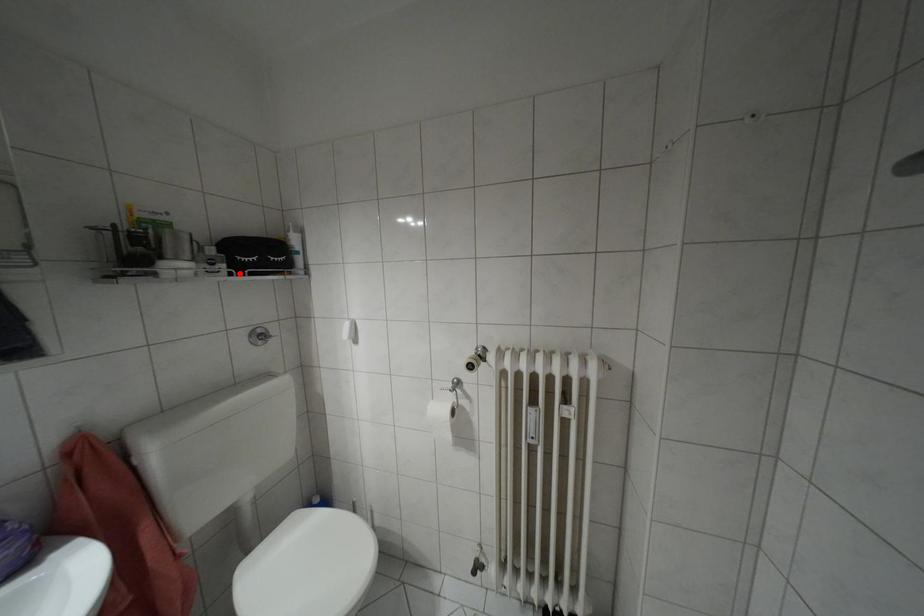
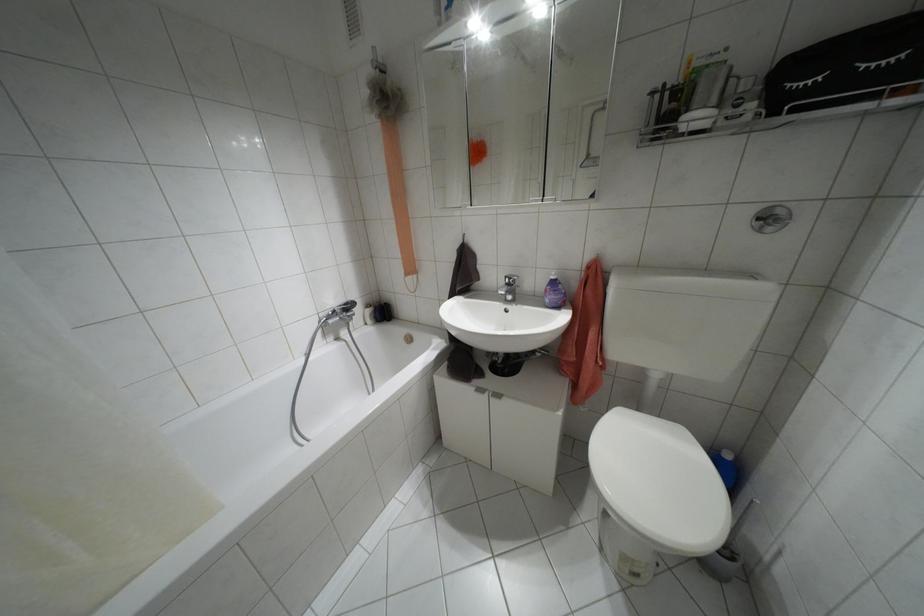
The point at the highlighted location is marked in the first image. Where is the corresponding point in the second image?

(773, 113)